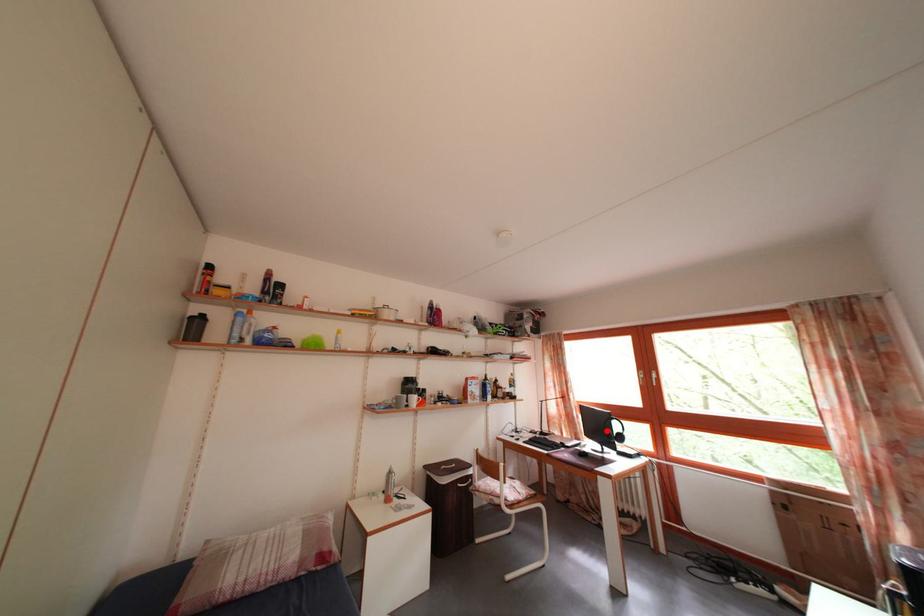
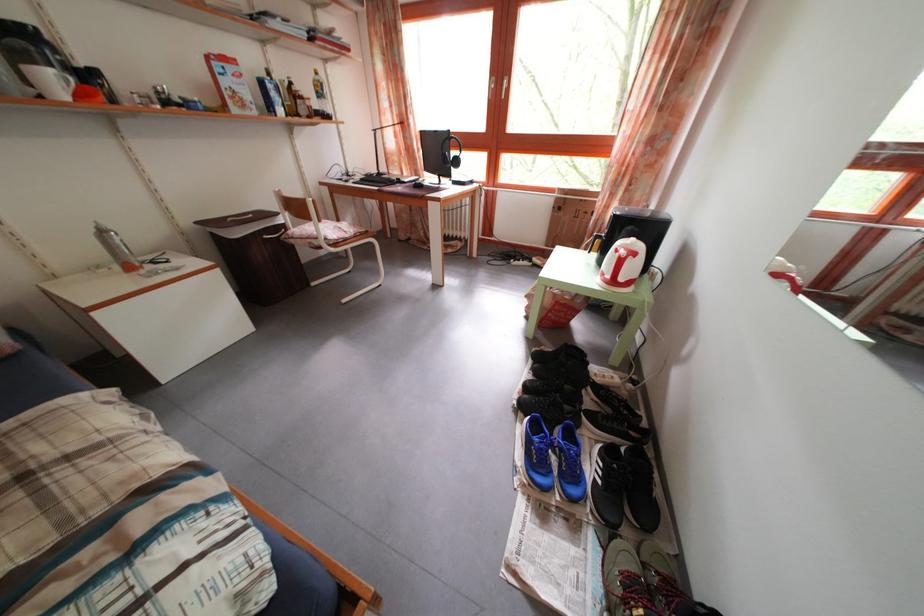
Question: I am providing you with two images of the same scene from different viewpoints. In image1, a red point is highlighted. Considering the same 3D point in image2, which of the following is correct?

Choices:
 (A) It is closer
 (B) It is farther

Answer: (A)